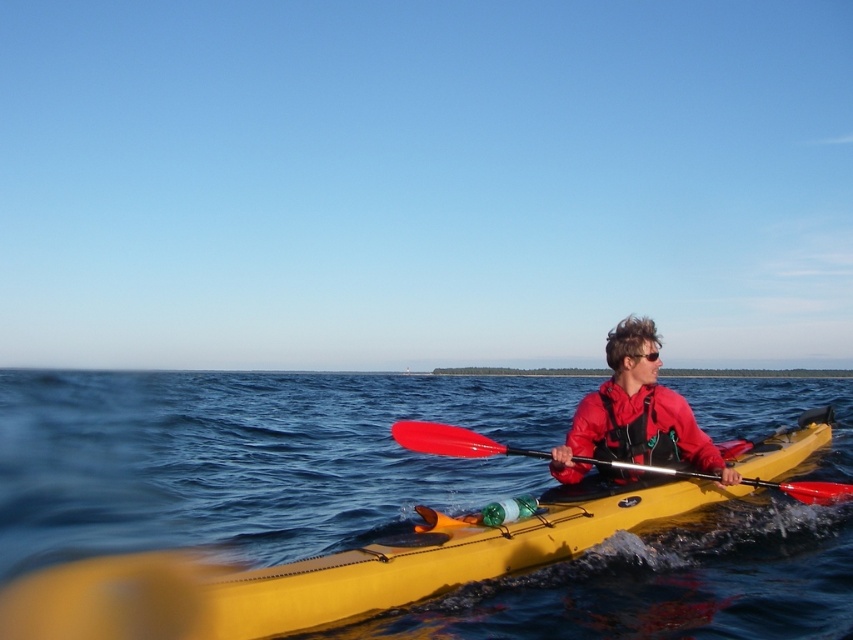
You are a photographer trying to capture the kayaker in the image. You want to ensure the red matte jacket at center and the blue water at center are both visible in your shot. Based on their positions, which object should appear lower in the photo?

The blue water at center should appear lower in the photo because it is located below the red matte jacket at center.

You are a photographer trying to capture the kayaker. You notice the red matte jacket at center and the red plastic paddle at center in your shot. Which object appears narrower in the photo?

The red matte jacket at center appears narrower than the red plastic paddle at center in the photo.